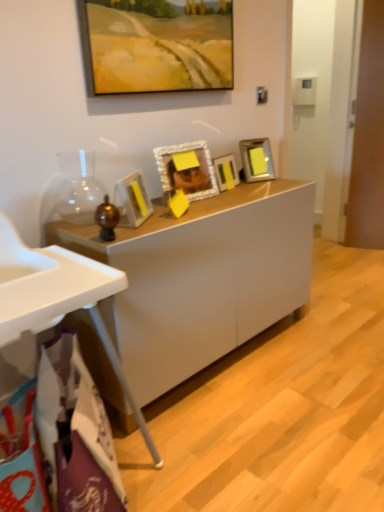
Question: Is metallic silver picture frame at center-right, acting as the 4th picture frame starting from the bottom, to the left or to the right of matte yellow picture frame at center, which appears as the 5th picture frame when viewed from the top, in the image?

Choices:
 (A) right
 (B) left

Answer: (A)

Question: From a real-world perspective, is metallic silver picture frame at center-right, acting as the 4th picture frame starting from the bottom, physically located above or below matte yellow picture frame at center, which appears as the 5th picture frame when viewed from the top?

Choices:
 (A) above
 (B) below

Answer: (A)

Question: Which object is positioned closest to the matte yellow picture frame at center, which is the first picture frame in bottom-to-top order?

Choices:
 (A) white textured picture frame at center, which ranks as the second picture frame in bottom-to-top order
 (B) matte yellow painting at upper center, the 1th picture frame from the top
 (C) metallic silver picture frame at center, which is the 3th picture frame from top to bottom
 (D) metallic silver picture frame at center-right, acting as the 2th picture frame starting from the top
 (E) white plastic high chair at lower left

Answer: (A)

Question: Which object is positioned closest to the matte yellow picture frame at center, which appears as the 5th picture frame when viewed from the top?

Choices:
 (A) metallic silver picture frame at center-right, acting as the 2th picture frame starting from the top
 (B) white plastic high chair at lower left
 (C) matte yellow painting at upper center, the 1th picture frame from the top
 (D) white textured picture frame at center, placed as the 4th picture frame when sorted from top to bottom
 (E) white glossy cabinet at center

Answer: (D)